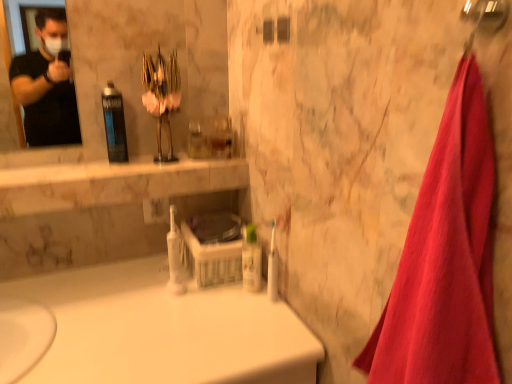
Image resolution: width=512 pixels, height=384 pixels. I want to click on clear plastic bottle at center, positioned as the 3th mouthwash in left-to-right order, so click(x=251, y=259).

This screenshot has width=512, height=384. What do you see at coordinates (445, 258) in the screenshot?
I see `red cotton towel at right` at bounding box center [445, 258].

What do you see at coordinates (164, 330) in the screenshot? I see `white glossy bathtub at center` at bounding box center [164, 330].

In order to face white plastic toothbrush at center, positioned as the 2th mouthwash in right-to-left order, should I rotate leftwards or rightwards?

To align with it, rotate left about 10.860°.

Identify the location of clear plastic bottle at center, placed as the 1th mouthwash when sorted from right to left. This screenshot has height=384, width=512. (251, 259).

From a real-world perspective, is red cotton towel at right physically located above or below white plastic toothbrush at center, which ranks as the second mouthwash in bottom-to-top order?

In terms of real-world spatial position, red cotton towel at right is above white plastic toothbrush at center, which ranks as the second mouthwash in bottom-to-top order.

Is point (431, 357) behind point (177, 253)?

No, it is in front of (177, 253).

Is red cotton towel at right with white plastic toothbrush at center, which ranks as the second mouthwash in bottom-to-top order?

No, red cotton towel at right is not beside white plastic toothbrush at center, which ranks as the second mouthwash in bottom-to-top order.

From the image's perspective, who appears lower, red cotton towel at right or white plastic toothbrush at center, which ranks as the second mouthwash in bottom-to-top order?

white plastic toothbrush at center, which ranks as the second mouthwash in bottom-to-top order, from the image's perspective.

From a real-world perspective, who is located lower, translucent plastic mouthwash at center, the first mouthwash when ordered from top to bottom, or red cotton towel at right?

From a 3D spatial view, red cotton towel at right is below.

Considering their positions, is translucent plastic mouthwash at center, the first mouthwash when ordered from top to bottom, located in front of or behind red cotton towel at right?

translucent plastic mouthwash at center, the first mouthwash when ordered from top to bottom, is behind red cotton towel at right.

Is red cotton towel at right located within translucent plastic mouthwash at center, placed as the 1th mouthwash when sorted from left to right?

Definitely not — red cotton towel at right is not inside translucent plastic mouthwash at center, placed as the 1th mouthwash when sorted from left to right.

From the image's perspective, is translucent plastic mouthwash at center, the first mouthwash when ordered from top to bottom, above or below red cotton towel at right?

Based on their image positions, translucent plastic mouthwash at center, the first mouthwash when ordered from top to bottom, is located above red cotton towel at right.

Is point (403, 303) closer to camera compared to point (269, 252)?

Yes, it is.

From a real-world perspective, is red cotton towel at right positioned under white plastic toothbrush at center based on gravity?

No.

Which of these two, red cotton towel at right or white plastic toothbrush at center, stands shorter?

With less height is white plastic toothbrush at center.

Visually, is red cotton towel at right positioned to the left or to the right of white plastic toothbrush at center?

Clearly, red cotton towel at right is on the right of white plastic toothbrush at center in the image.

Is clear plastic bottle at center, which is the third mouthwash from top to bottom, facing towards translucent plastic mouthwash at center, placed as the 1th mouthwash when sorted from left to right?

No, clear plastic bottle at center, which is the third mouthwash from top to bottom, does not turn towards translucent plastic mouthwash at center, placed as the 1th mouthwash when sorted from left to right.

Can you tell me how much clear plastic bottle at center, which is the third mouthwash from top to bottom, and translucent plastic mouthwash at center, which is the 3th mouthwash in right-to-left order, differ in facing direction?

1.71 degrees.

How far apart are clear plastic bottle at center, positioned as the 3th mouthwash in left-to-right order, and translucent plastic mouthwash at center, the first mouthwash when ordered from top to bottom?

A distance of 45.22 centimeters exists between clear plastic bottle at center, positioned as the 3th mouthwash in left-to-right order, and translucent plastic mouthwash at center, the first mouthwash when ordered from top to bottom.

Locate an element on the screen. mouthwash behind the clear plastic bottle at center, placed as the 1th mouthwash when sorted from right to left is located at coordinates (114, 124).

Identify the location of bathtub lying below the translucent plastic mouthwash at center, which is the 3th mouthwash in right-to-left order (from the image's perspective). (164, 330).

Is translucent plastic mouthwash at center, placed as the 1th mouthwash when sorted from left to right, at the left side of white glossy bathtub at center?

Yes.

Considering the relative sizes of translucent plastic mouthwash at center, placed as the 1th mouthwash when sorted from left to right, and white glossy bathtub at center in the image provided, is translucent plastic mouthwash at center, placed as the 1th mouthwash when sorted from left to right, shorter than white glossy bathtub at center?

Yes, translucent plastic mouthwash at center, placed as the 1th mouthwash when sorted from left to right, is shorter than white glossy bathtub at center.

What's the angular difference between translucent plastic mouthwash at center, which is the 3th mouthwash in right-to-left order, and white glossy bathtub at center's facing directions?

translucent plastic mouthwash at center, which is the 3th mouthwash in right-to-left order, and white glossy bathtub at center are facing 89.5 degrees away from each other.

Can you tell me how much white glossy bathtub at center and white plastic toothbrush at center differ in facing direction?

The facing directions of white glossy bathtub at center and white plastic toothbrush at center are 91.3 degrees apart.

Considering the points (131, 320) and (270, 254), which point is behind, point (131, 320) or point (270, 254)?

The point (270, 254) is farther from the camera.

Is white glossy bathtub at center further to camera compared to white plastic toothbrush at center?

No, white glossy bathtub at center is closer to the camera.

Identify the location of toiletry that appears behind the white glossy bathtub at center. The image size is (512, 384). (272, 267).

Is white plastic toothbrush at center closer to the viewer compared to white glossy bathtub at center?

No, it is not.

Does white plastic toothbrush at center turn towards white glossy bathtub at center?

No, white plastic toothbrush at center is not aimed at white glossy bathtub at center.

Consider the image. Considering the positions of objects white plastic toothbrush at center and white glossy bathtub at center in the image provided, who is more to the left, white plastic toothbrush at center or white glossy bathtub at center?

white glossy bathtub at center is more to the left.

Is white glossy bathtub at center completely or partially inside white plastic toothbrush at center?

Actually, white glossy bathtub at center is outside white plastic toothbrush at center.

The width and height of the screenshot is (512, 384). What are the coordinates of `bath towel lying above the white plastic toothbrush at center, the second mouthwash positioned from the left (from the image's perspective)` in the screenshot? It's located at (445, 258).

You are a GUI agent. You are given a task and a screenshot of the screen. Output one action in this format:
    pyautogui.click(x=<x>, y=<y>)
    Task: Click on the bath towel on the right of translucent plastic mouthwash at center, the first mouthwash when ordered from top to bottom
    
    Given the screenshot: What is the action you would take?
    pyautogui.click(x=445, y=258)

Looking at the image, which one is located closer to red cotton towel at right, clear plastic bottle at center, positioned as the 3th mouthwash in left-to-right order, or white plastic toothbrush at center, positioned as the 2th mouthwash in right-to-left order?

Among the two, clear plastic bottle at center, positioned as the 3th mouthwash in left-to-right order, is located nearer to red cotton towel at right.

When comparing their distances from translucent plastic mouthwash at center, which is the third mouthwash in bottom-to-top order, does white plastic toothbrush at center, positioned as the second mouthwash in top-to-bottom order, or white plastic toothbrush at center seem closer?

white plastic toothbrush at center, positioned as the second mouthwash in top-to-bottom order, is positioned closer to the anchor translucent plastic mouthwash at center, which is the third mouthwash in bottom-to-top order.

From the picture: Estimate the real-world distances between objects in this image. Which object is closer to translucent plastic mouthwash at center, which is the third mouthwash in bottom-to-top order, clear plastic bottle at center, which is the third mouthwash from top to bottom, or red cotton towel at right?

clear plastic bottle at center, which is the third mouthwash from top to bottom, is closer to translucent plastic mouthwash at center, which is the third mouthwash in bottom-to-top order.

Considering their positions, is white plastic toothbrush at center, positioned as the 2th mouthwash in right-to-left order, positioned further to clear plastic bottle at center, which is the third mouthwash from top to bottom, than white glossy bathtub at center?

white glossy bathtub at center is further to clear plastic bottle at center, which is the third mouthwash from top to bottom.

From the image, which object appears to be farther from white plastic toothbrush at center, the second mouthwash positioned from the left, translucent plastic mouthwash at center, which is the third mouthwash in bottom-to-top order, or red cotton towel at right?

red cotton towel at right is further to white plastic toothbrush at center, the second mouthwash positioned from the left.

Based on their spatial positions, is translucent plastic mouthwash at center, the first mouthwash when ordered from top to bottom, or white plastic toothbrush at center closer to clear plastic bottle at center, which is the third mouthwash from top to bottom?

Based on the image, white plastic toothbrush at center appears to be nearer to clear plastic bottle at center, which is the third mouthwash from top to bottom.

Looking at the image, which one is located further to translucent plastic mouthwash at center, the first mouthwash when ordered from top to bottom, white plastic toothbrush at center, which ranks as the second mouthwash in bottom-to-top order, or clear plastic bottle at center, which is the third mouthwash from top to bottom?

clear plastic bottle at center, which is the third mouthwash from top to bottom, lies further to translucent plastic mouthwash at center, the first mouthwash when ordered from top to bottom, than the other object.

From the image, which object appears to be farther from white plastic toothbrush at center, translucent plastic mouthwash at center, placed as the 1th mouthwash when sorted from left to right, or clear plastic bottle at center, placed as the 1th mouthwash when sorted from bottom to top?

translucent plastic mouthwash at center, placed as the 1th mouthwash when sorted from left to right, lies further to white plastic toothbrush at center than the other object.

In order to click on toiletry located between red cotton towel at right and clear plastic bottle at center, which is the third mouthwash from top to bottom, in the depth direction in this screenshot , I will do `click(272, 267)`.

This screenshot has height=384, width=512. In order to click on toiletry located between red cotton towel at right and white plastic toothbrush at center, positioned as the second mouthwash in top-to-bottom order, in the depth direction in this screenshot , I will do `click(272, 267)`.

This screenshot has width=512, height=384. I want to click on mouthwash positioned between red cotton towel at right and clear plastic bottle at center, placed as the 1th mouthwash when sorted from right to left, from near to far, so click(176, 258).

You are a GUI agent. You are given a task and a screenshot of the screen. Output one action in this format:
    pyautogui.click(x=<x>, y=<y>)
    Task: Click on the bathtub between red cotton towel at right and white plastic toothbrush at center along the z-axis
    The height and width of the screenshot is (384, 512).
    Given the screenshot: What is the action you would take?
    pyautogui.click(x=164, y=330)